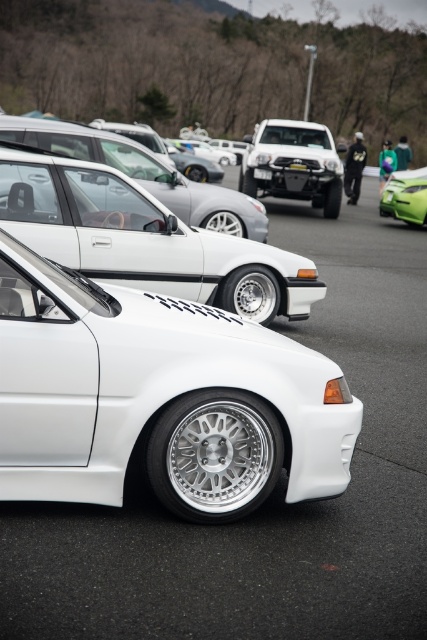
You are a photographer setting up a shot of the matte black truck at center and the white plastic license plate at center. You want to ensure both are in focus. Since the license plate is closer to the camera, will you need to adjust your focus to capture both clearly?

The matte black truck at center is wider than the white plastic license plate at center, so adjusting focus might be necessary as the truck occupies more space in the frame, potentially requiring a different focal plane.